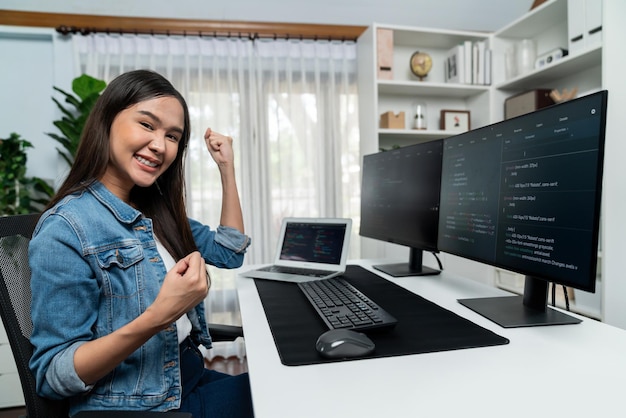
What are the coordinates of `globe` in the screenshot? It's located at (422, 65).